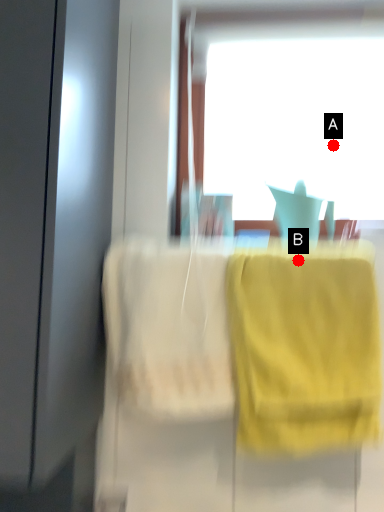
Question: Two points are circled on the image, labeled by A and B beside each circle. Which point is closer to the camera?

Choices:
 (A) A is closer
 (B) B is closer

Answer: (B)